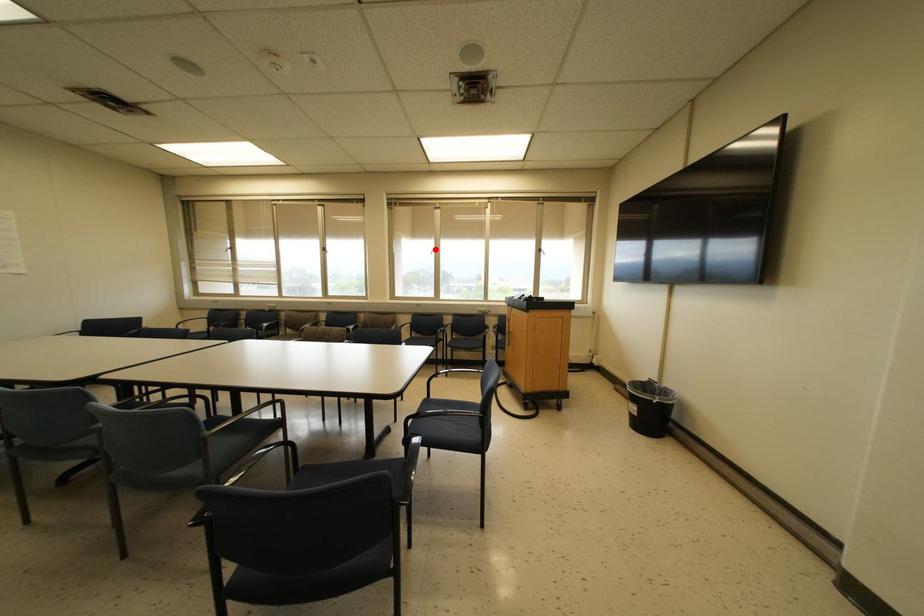
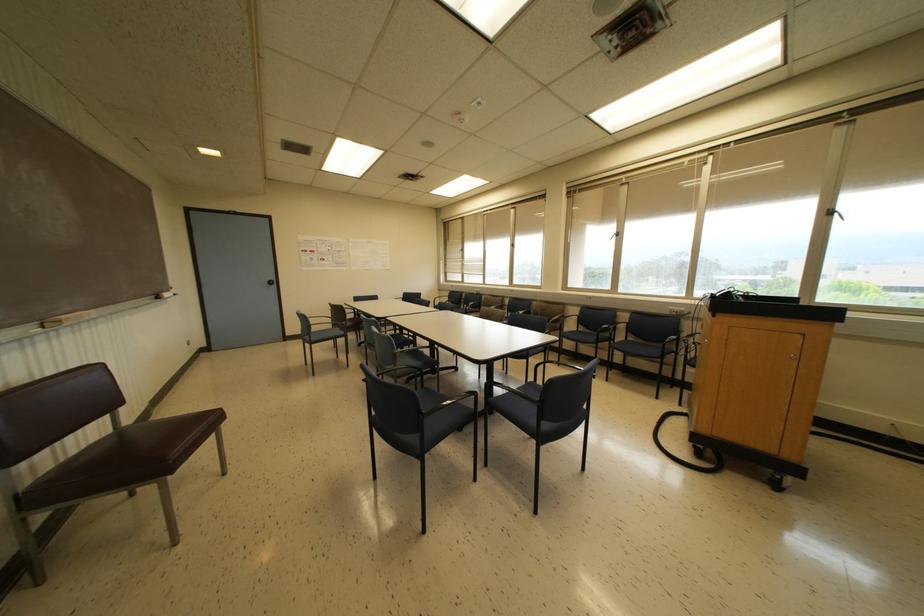
Question: I am providing you with two images of the same scene from different viewpoints. A red point is shown in image1. For the corresponding object point in image2, is it positioned nearer or farther from the camera?

Choices:
 (A) Nearer
 (B) Farther

Answer: (B)